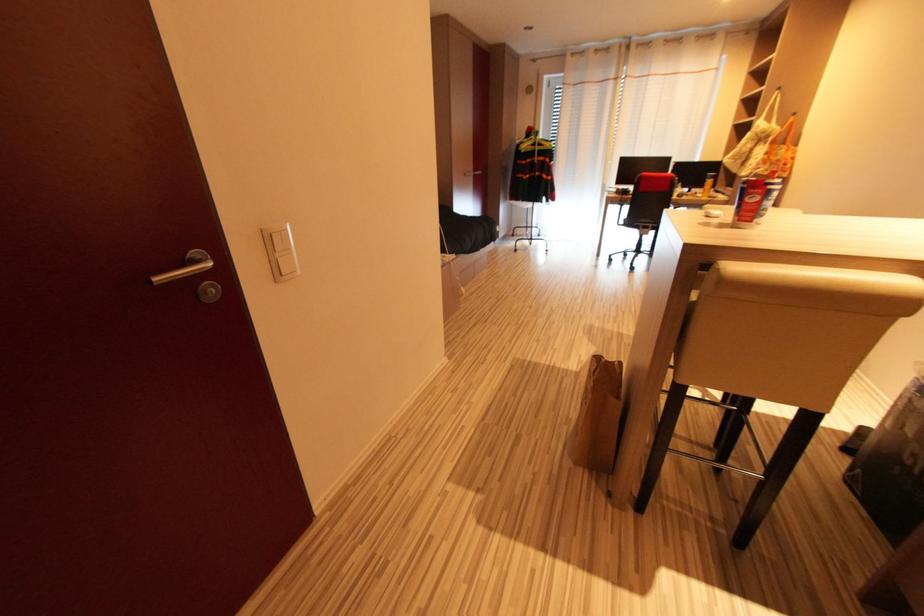
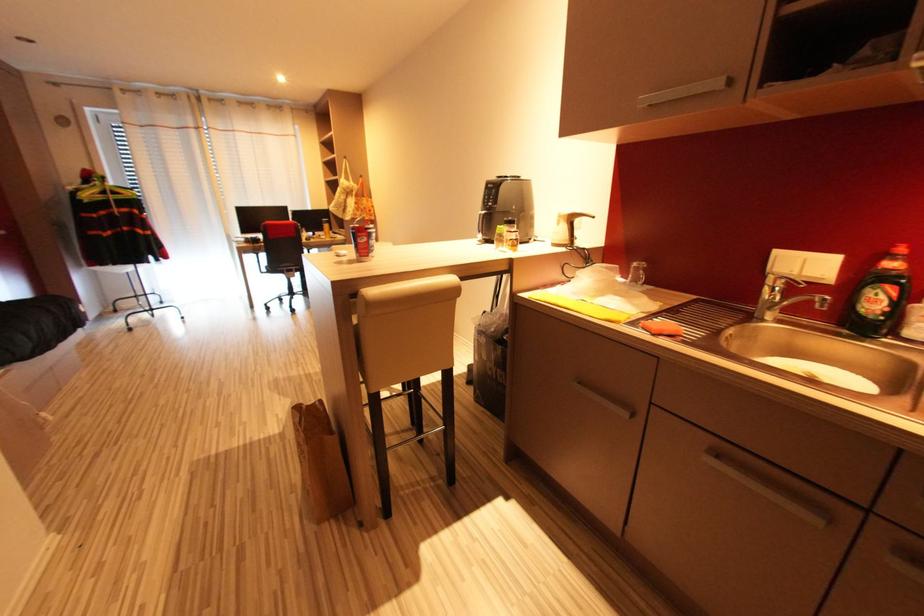
Question: How did the camera likely rotate?

Choices:
 (A) Left
 (B) Right
 (C) Up
 (D) Down

Answer: (B)